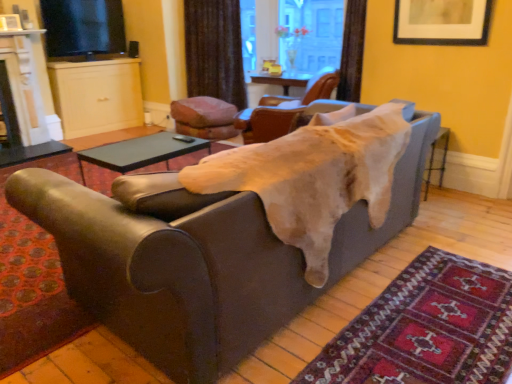
Question: Is brown fabric curtain at upper center taller or shorter than velvet-like brown cushion at center, the 3th chair in the right-to-left sequence?

Choices:
 (A) tall
 (B) short

Answer: (A)

Question: Is brown fabric curtain at upper center to the left or to the right of velvet-like brown cushion at center, the 1th chair positioned from the left, in the image?

Choices:
 (A) left
 (B) right

Answer: (B)

Question: Which object is the farthest from the velvet-like brown cushion at center, the 1th chair positioned from the left?

Choices:
 (A) black glossy tv at upper left
 (B) brown leather chair at upper center, the 3th chair from the left
 (C) brown fabric curtain at upper center
 (D) black matte table at center
 (E) leather chair at center, marked as the second chair in a right-to-left arrangement

Answer: (A)

Question: Which object is positioned farthest from the leather couch at center?

Choices:
 (A) brown fabric curtain at upper center
 (B) velvet-like brown cushion at center, the 1th chair positioned from the left
 (C) leather chair at center, marked as the second chair in a right-to-left arrangement
 (D) brown leather chair at upper center, which is the 1th chair from right to left
 (E) transparent glass door at upper center

Answer: (E)